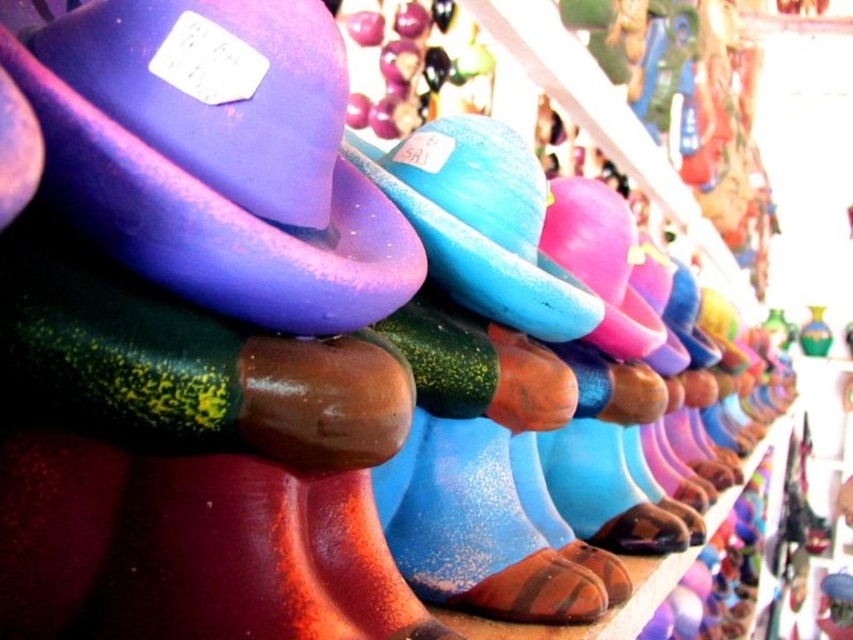
Does purple matte hat at upper left have a greater height compared to satin blue hat at center?

Incorrect, purple matte hat at upper left's height is not larger of satin blue hat at center's.

Does purple matte hat at upper left appear under satin blue hat at center?

No.

The width and height of the screenshot is (853, 640). I want to click on purple matte hat at upper left, so click(x=216, y=156).